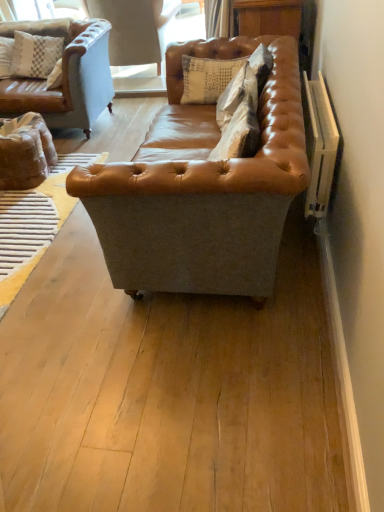
Question: Can you confirm if suede textured pillow at center, marked as the first pillow in a bottom-to-top arrangement, is smaller than saddle brown leather couch at center?

Choices:
 (A) yes
 (B) no

Answer: (A)

Question: Could you tell me if suede textured pillow at center, the second pillow viewed from the top, is turned towards saddle brown leather couch at center?

Choices:
 (A) yes
 (B) no

Answer: (A)

Question: From the image's perspective, is suede textured pillow at center, marked as the first pillow in a bottom-to-top arrangement, beneath saddle brown leather couch at center?

Choices:
 (A) no
 (B) yes

Answer: (A)

Question: Can you confirm if suede textured pillow at center, arranged as the second pillow when viewed from the back, is shorter than saddle brown leather couch at center?

Choices:
 (A) no
 (B) yes

Answer: (B)

Question: Does suede textured pillow at center, marked as the first pillow in a bottom-to-top arrangement, appear on the right side of saddle brown leather couch at center?

Choices:
 (A) no
 (B) yes

Answer: (B)

Question: In the image, is light blue leather swivel chair at upper left positioned in front of or behind saddle brown leather couch at center?

Choices:
 (A) front
 (B) behind

Answer: (B)

Question: Is light blue leather swivel chair at upper left to the left or to the right of saddle brown leather couch at center in the image?

Choices:
 (A) left
 (B) right

Answer: (A)

Question: Looking at the image, does light blue leather swivel chair at upper left seem bigger or smaller compared to saddle brown leather couch at center?

Choices:
 (A) small
 (B) big

Answer: (A)

Question: From the image's perspective, is light blue leather swivel chair at upper left above or below saddle brown leather couch at center?

Choices:
 (A) below
 (B) above

Answer: (B)

Question: Considering the positions of point (162, 211) and point (206, 70), is point (162, 211) closer or farther from the camera than point (206, 70)?

Choices:
 (A) farther
 (B) closer

Answer: (B)

Question: Looking at their shapes, would you say saddle brown leather couch at center is wider or thinner than leather/cushion at center, acting as the 1th pillow starting from the back?

Choices:
 (A) wide
 (B) thin

Answer: (A)

Question: Which is correct: saddle brown leather couch at center is inside leather/cushion at center, acting as the 1th pillow starting from the back, or outside of it?

Choices:
 (A) outside
 (B) inside

Answer: (A)

Question: Based on their sizes in the image, would you say saddle brown leather couch at center is bigger or smaller than leather/cushion at center, which is the second pillow in front-to-back order?

Choices:
 (A) big
 (B) small

Answer: (A)

Question: From a real-world perspective, relative to light blue leather swivel chair at upper left, is leather/cushion at center, which is the second pillow in front-to-back order, vertically above or below?

Choices:
 (A) below
 (B) above

Answer: (B)

Question: In terms of size, does leather/cushion at center, acting as the 1th pillow starting from the back, appear bigger or smaller than light blue leather swivel chair at upper left?

Choices:
 (A) big
 (B) small

Answer: (B)